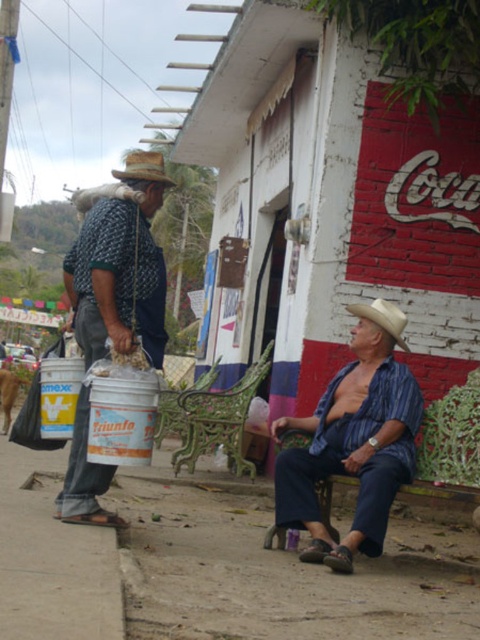
Does point (79, 332) lie in front of point (28, 493)?

Yes, point (79, 332) is closer to viewer.

Does matte black bucket at left have a greater width compared to brown dirt at lower left?

No.

Who is more distant from viewer, (92, 323) or (107, 554)?

Positioned behind is point (92, 323).

Where is `matte black bucket at left`? matte black bucket at left is located at coordinates [x=120, y=262].

Does matte white bucket at left have a greater width compared to beige straw hat at lower right?

Correct, the width of matte white bucket at left exceeds that of beige straw hat at lower right.

Can you confirm if matte white bucket at left is shorter than beige straw hat at lower right?

No.

Where is `matte white bucket at left`? This screenshot has height=640, width=480. matte white bucket at left is located at coordinates (351, 449).

Locate an element on the screen. The width and height of the screenshot is (480, 640). matte white bucket at left is located at coordinates (351, 449).

Between matte white bucket at left and matte black bucket at left, which one appears on the right side from the viewer's perspective?

matte white bucket at left is more to the right.

Can you confirm if matte white bucket at left is taller than matte black bucket at left?

In fact, matte white bucket at left may be shorter than matte black bucket at left.

Is point (359, 410) closer to camera compared to point (121, 308)?

No, (359, 410) is behind (121, 308).

This screenshot has width=480, height=640. I want to click on matte white bucket at left, so click(351, 449).